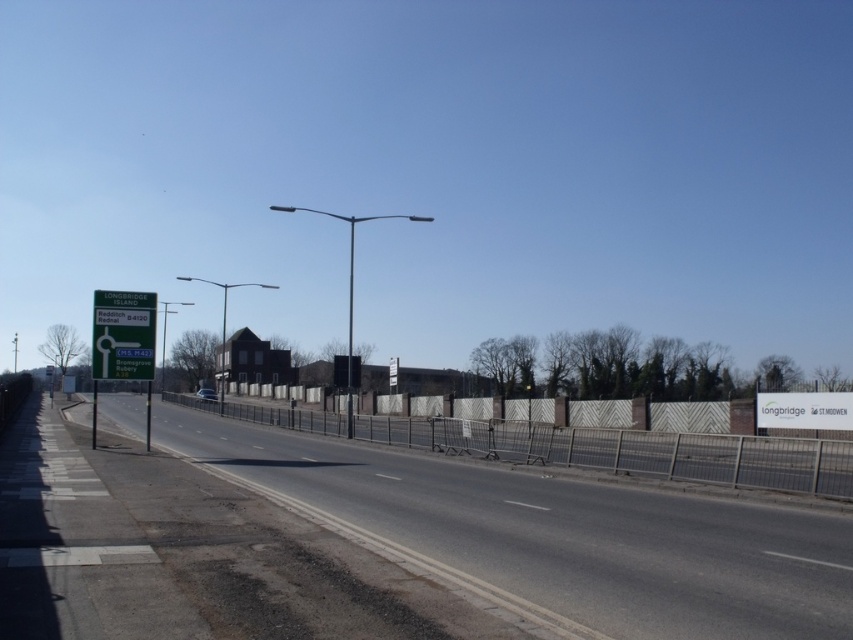
Question: Is white wood fence at center thinner than green plastic sign at left?

Choices:
 (A) no
 (B) yes

Answer: (A)

Question: Which is farther from the asphalt road at left?

Choices:
 (A) green plastic sign at left
 (B) white wood fence at center

Answer: (B)

Question: Does white wood fence at center appear under green plastic sign at left?

Choices:
 (A) yes
 (B) no

Answer: (A)

Question: Does asphalt road at left appear on the left side of green plastic sign at left?

Choices:
 (A) yes
 (B) no

Answer: (B)

Question: Estimate the real-world distances between objects in this image. Which object is closer to the white wood fence at center?

Choices:
 (A) green plastic sign at left
 (B) asphalt road at left

Answer: (B)

Question: Which object appears farthest from the camera in this image?

Choices:
 (A) white wood fence at center
 (B) green plastic sign at left
 (C) asphalt road at left

Answer: (B)